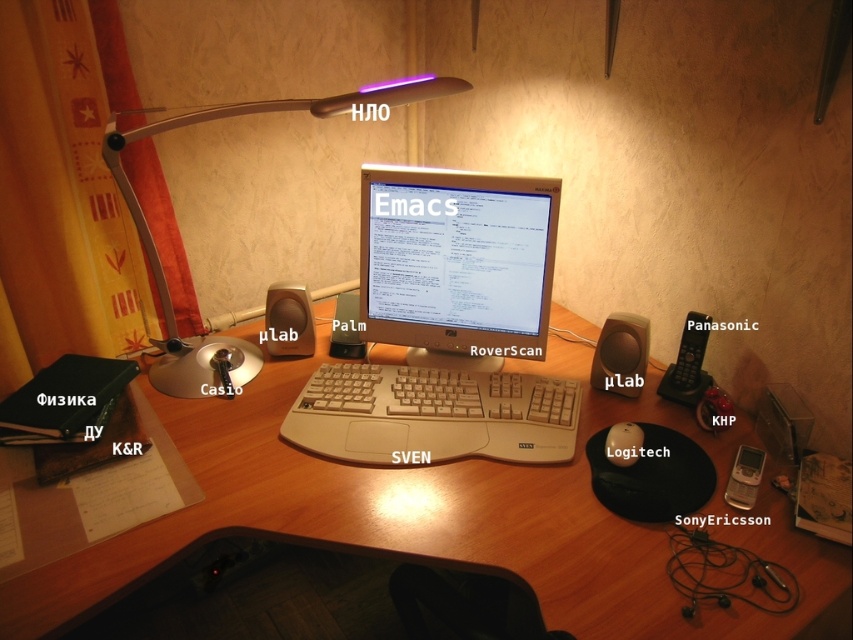
Between point (602, 339) and point (604, 445), which one is positioned in front?

Positioned in front is point (604, 445).

Looking at this image, does matte brown speaker at center-right come in front of matte black mouse at center-right?

No, matte brown speaker at center-right is behind matte black mouse at center-right.

What are the coordinates of `matte brown speaker at center-right` in the screenshot? It's located at (619, 355).

Between point (115, 152) and point (354, 291), which one is positioned behind?

The point (354, 291) is behind.

Is metallic gray lamp at upper left smaller than matte plastic speaker at center?

Actually, metallic gray lamp at upper left might be larger than matte plastic speaker at center.

Where is `metallic gray lamp at upper left`? The width and height of the screenshot is (853, 640). metallic gray lamp at upper left is located at coordinates (245, 115).

Does wooden desk at center appear on the right side of beige plastic monitor at center?

Correct, you'll find wooden desk at center to the right of beige plastic monitor at center.

Does wooden desk at center have a greater width compared to beige plastic monitor at center?

Indeed, wooden desk at center has a greater width compared to beige plastic monitor at center.

At what (x,y) coordinates should I click in order to perform the action: click on wooden desk at center. Please return your answer as a coordinate pair (x, y). Looking at the image, I should click on (442, 516).